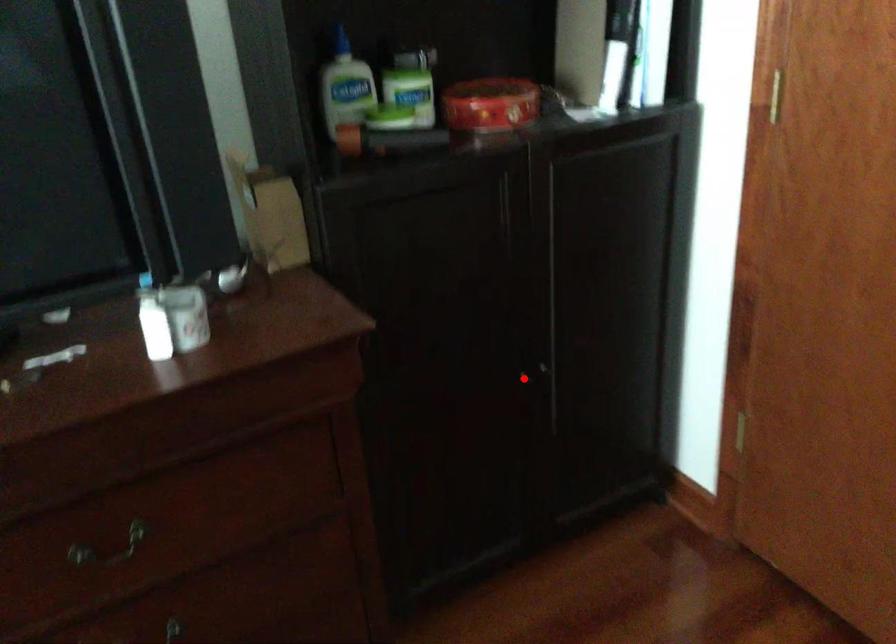
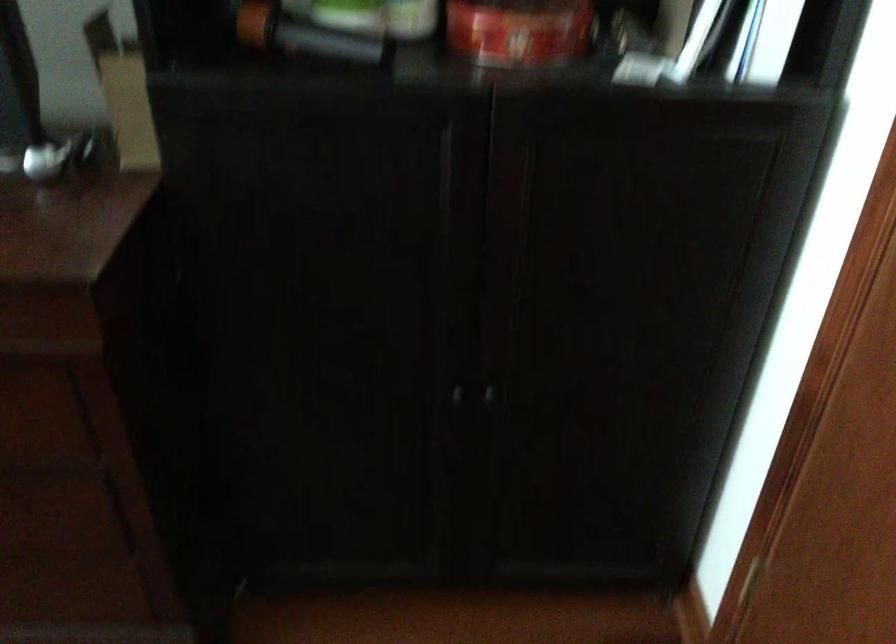
Find the pixel in the second image that matches the highlighted location in the first image.

(457, 395)